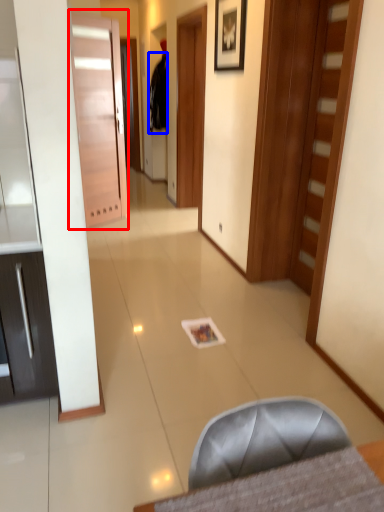
Question: Which point is further to the camera, door (highlighted by a red box) or robe (highlighted by a blue box)?

Choices:
 (A) door
 (B) robe

Answer: (B)